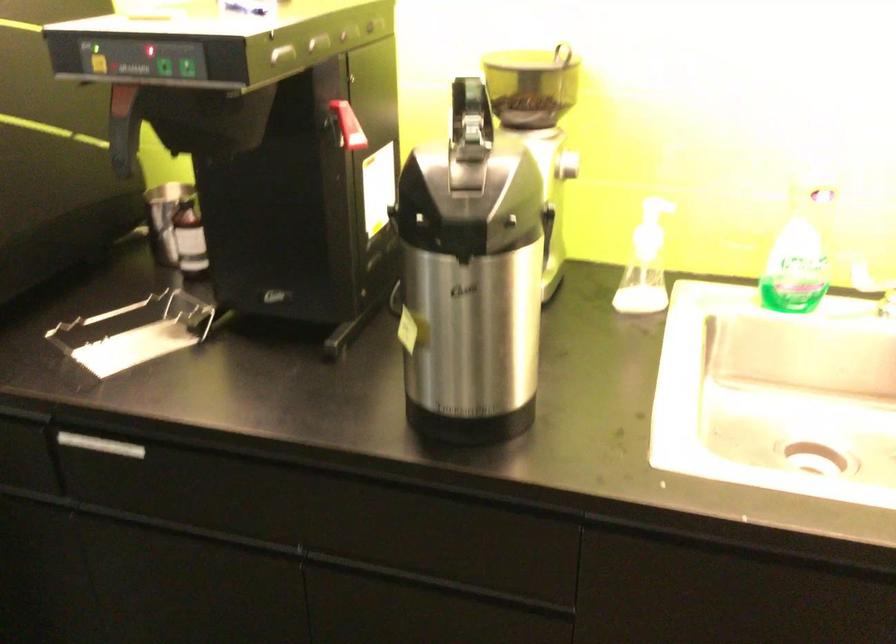
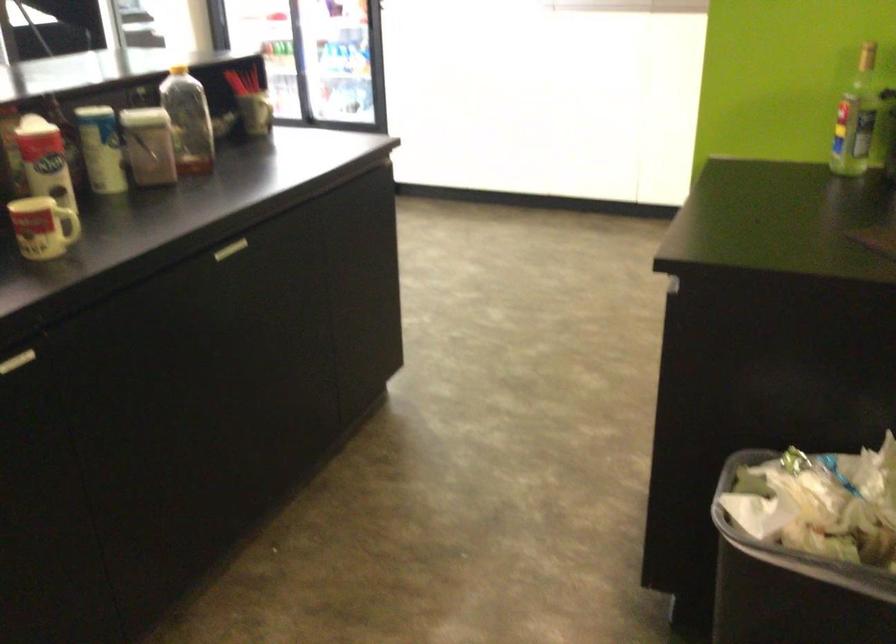
The first image is from the beginning of the video and the second image is from the end. How did the camera likely rotate when shooting the video?

The rotation direction of the camera is left-down.